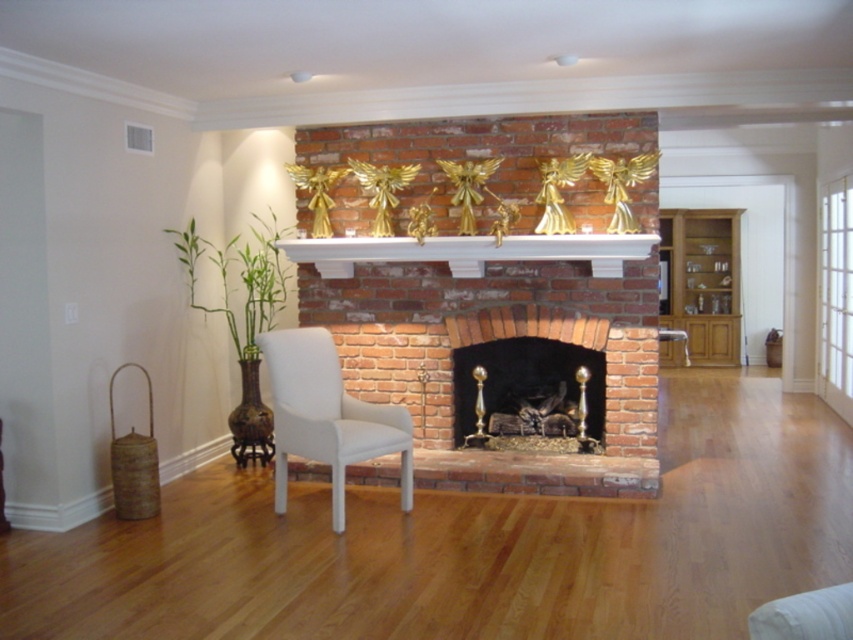
You are an interior designer assessing the living room layout. You need to determine if a floor lamp that is 1.8 meters tall can be placed next to the oak cabinet at right without blocking the view of the white painted wood mantle at center. Can it fit?

The oak cabinet at right is taller than the white painted wood mantle at center. Since the floor lamp is 1.8 meters tall, and the oak cabinet is taller than the mantle, it depends on the cabinet height. However, since the mantle is shorter, placing the lamp next to the cabinet might not block the mantle view as the cabinet itself is taller. But without exact measurements, it is uncertain. However, according to the description, the cabinet is taller, so the lamp could be placed there as it won not exceed the

You are arranging a new painting to hang on the wall between the oak cabinet at right and the white painted wood mantle at center. Which object should the painting be closer to if you want it centered between them?

The oak cabinet at right is positioned on the right side of the white painted wood mantle at center. Therefore, to center the painting between them, it should be equidistant from both the oak cabinet at right and the white painted wood mantle at center.

You are standing in the living room and want to place a 5 meter long sofa in front of the brick fireplace at center. Can you fit it there?

The brick fireplace at center is 4.81 meters away from the viewer. Since the sofa is 5 meters long, it would not fit in front of the fireplace as the distance is shorter than the sofa length.